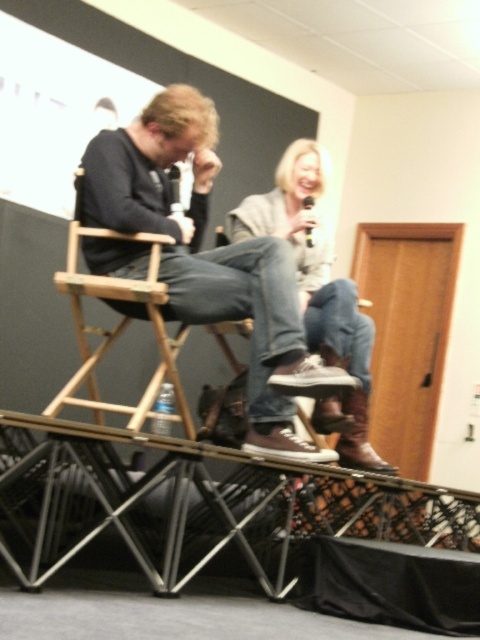
Question: Is denim jeans at center bigger than wooden director's chair at left?

Choices:
 (A) yes
 (B) no

Answer: (B)

Question: Which of the following is the farthest from the observer?

Choices:
 (A) (312, 417)
 (B) (95, 228)
 (C) (290, 424)

Answer: (A)

Question: Estimate the real-world distances between objects in this image. Which object is closer to the denim jeans at center?

Choices:
 (A) wooden director's chair at left
 (B) matte black sneakers at center

Answer: (B)

Question: Is denim jeans at center smaller than wooden director's chair at left?

Choices:
 (A) no
 (B) yes

Answer: (B)

Question: Based on their relative distances, which object is nearer to the denim jeans at center?

Choices:
 (A) wooden director's chair at left
 (B) matte black sneakers at center

Answer: (B)

Question: Is denim jeans at center thinner than wooden director's chair at left?

Choices:
 (A) no
 (B) yes

Answer: (B)